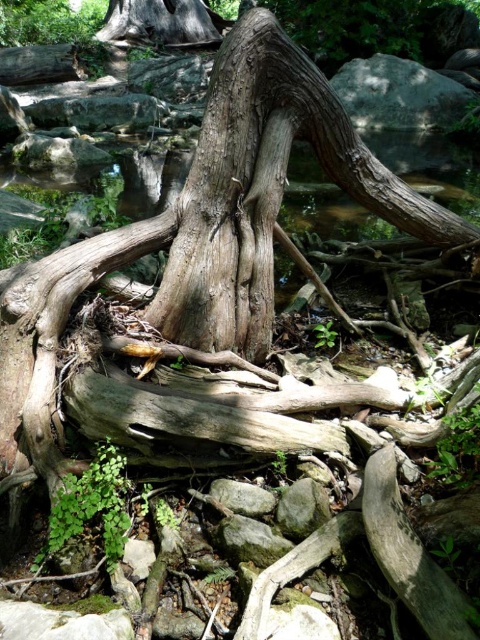
Question: Is gray rough rock at upper center bigger than gray rough rock at center?

Choices:
 (A) no
 (B) yes

Answer: (B)

Question: Which point is closer to the camera?

Choices:
 (A) gray rough rock at upper center
 (B) gray rough rock at center

Answer: (B)

Question: Is gray rough rock at upper center below gray rough rock at center?

Choices:
 (A) no
 (B) yes

Answer: (A)

Question: Which of the following is the farthest from the observer?

Choices:
 (A) (220, 497)
 (B) (405, 77)

Answer: (B)

Question: Is the position of gray rough rock at upper center less distant than that of gray rough rock at center?

Choices:
 (A) no
 (B) yes

Answer: (A)